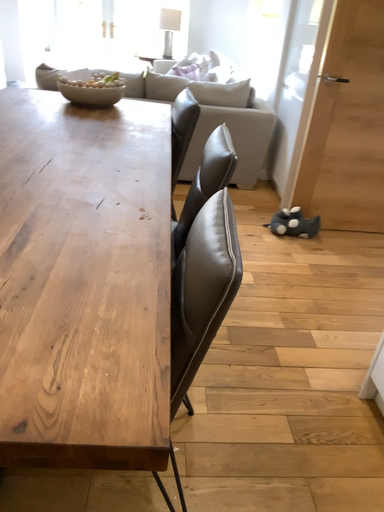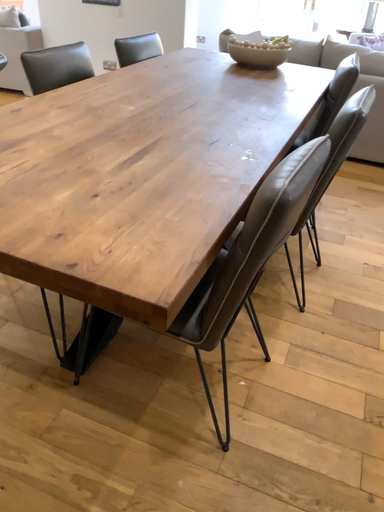
Question: Which way did the camera rotate in the video?

Choices:
 (A) rotated right
 (B) rotated left

Answer: (B)